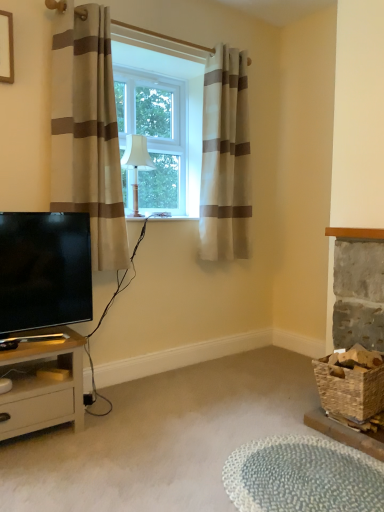
This screenshot has height=512, width=384. I want to click on vacant area that lies to the right of light beige wood nightstand at lower left, so click(x=108, y=434).